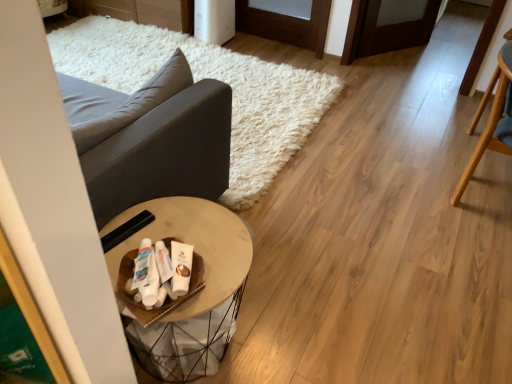
Locate an element on the screen. vacant space behind white matte lotion at center, arranged as the first toiletry when viewed from the right is located at coordinates (196, 235).